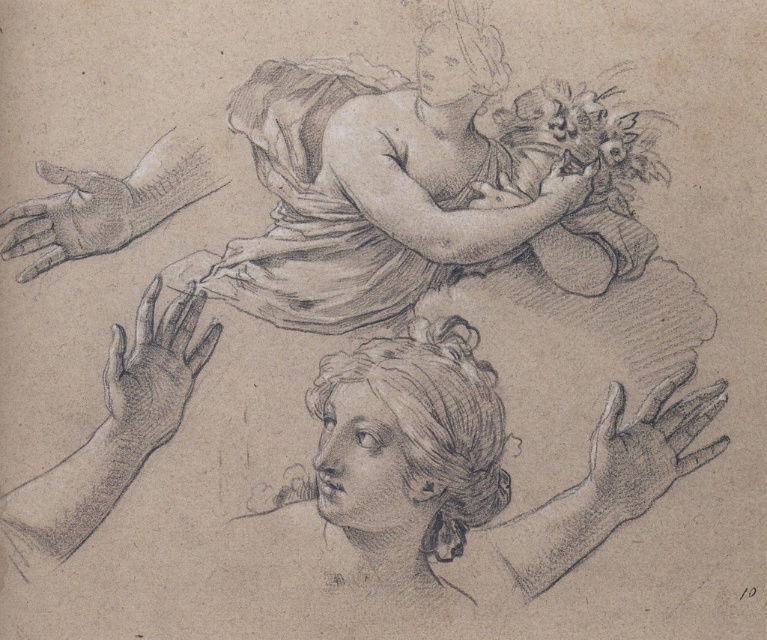
Question: Which object appears closest to the camera in this image?

Choices:
 (A) smooth skin hand at upper center
 (B) smooth gray hand at lower left
 (C) smooth gray hand at lower right
 (D) smooth paper head at upper center

Answer: (C)

Question: In this image, where is smooth gray hair at lower center located relative to smooth gray hand at lower right?

Choices:
 (A) above
 (B) below

Answer: (A)

Question: Can you confirm if smooth gray hair at lower center is bigger than smooth gray glove at left?

Choices:
 (A) no
 (B) yes

Answer: (B)

Question: Which point is closer to the camera?

Choices:
 (A) smooth skin hand at upper center
 (B) smooth paper head at upper center

Answer: (A)

Question: Is smooth gray hand at lower left to the right of smooth skin hand at upper center from the viewer's perspective?

Choices:
 (A) yes
 (B) no

Answer: (B)

Question: Considering the real-world distances, which object is closest to the smooth gray glove at left?

Choices:
 (A) smooth gray hand at lower left
 (B) smooth paper head at upper center
 (C) smooth skin hand at upper center
 (D) smooth fabric head at upper center

Answer: (A)